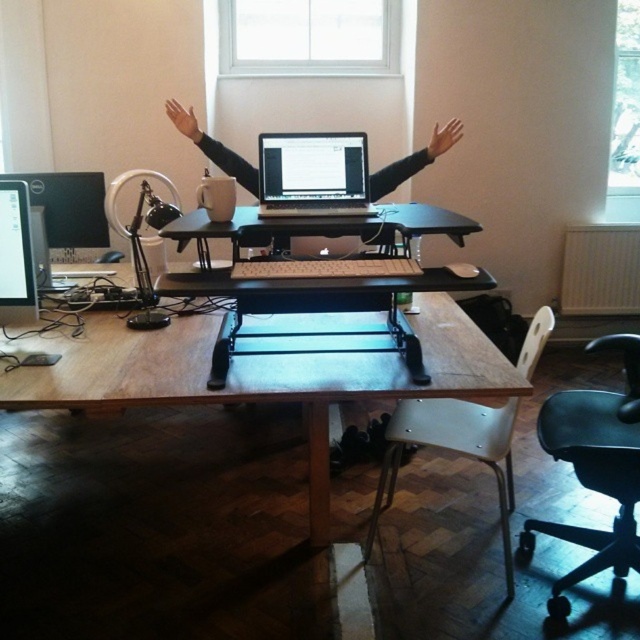
Question: Can you confirm if wooden table at center is positioned above black matte arm at upper right?

Choices:
 (A) no
 (B) yes

Answer: (A)

Question: Which object appears farthest from the camera in this image?

Choices:
 (A) satin black laptop at center
 (B) black matte arm at upper right
 (C) brown leather hand at upper right
 (D) wooden table at center

Answer: (C)

Question: Which of these objects is positioned farthest from the matte black laptop at upper center?

Choices:
 (A) brown leather hand at upper right
 (B) matte black laptop at center
 (C) matte black monitor at left
 (D) skinny white hand at upper center

Answer: (A)

Question: Is white plastic swivel chair at lower right positioned at the back of matte black laptop at center?

Choices:
 (A) no
 (B) yes

Answer: (A)

Question: Does black leather swivel chair at lower right appear on the right side of matte black monitor at left?

Choices:
 (A) no
 (B) yes

Answer: (B)

Question: Among these objects, which one is farthest from the camera?

Choices:
 (A) matte black monitor at left
 (B) brown leather hand at upper right

Answer: (B)